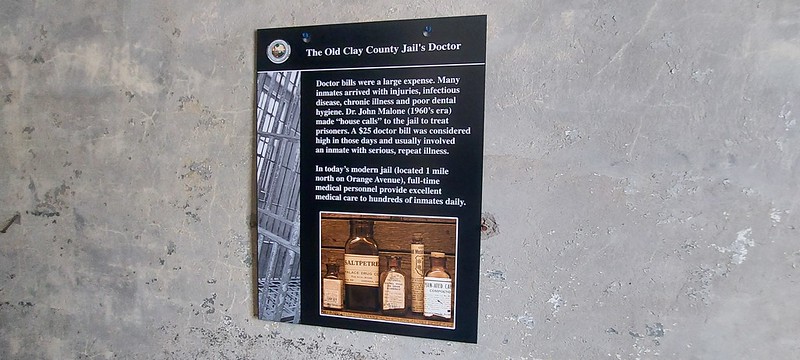
This screenshot has width=800, height=360. In order to click on bottles in this screenshot , I will do `click(333, 274)`, `click(364, 231)`, `click(396, 264)`, `click(418, 240)`, `click(438, 265)`.